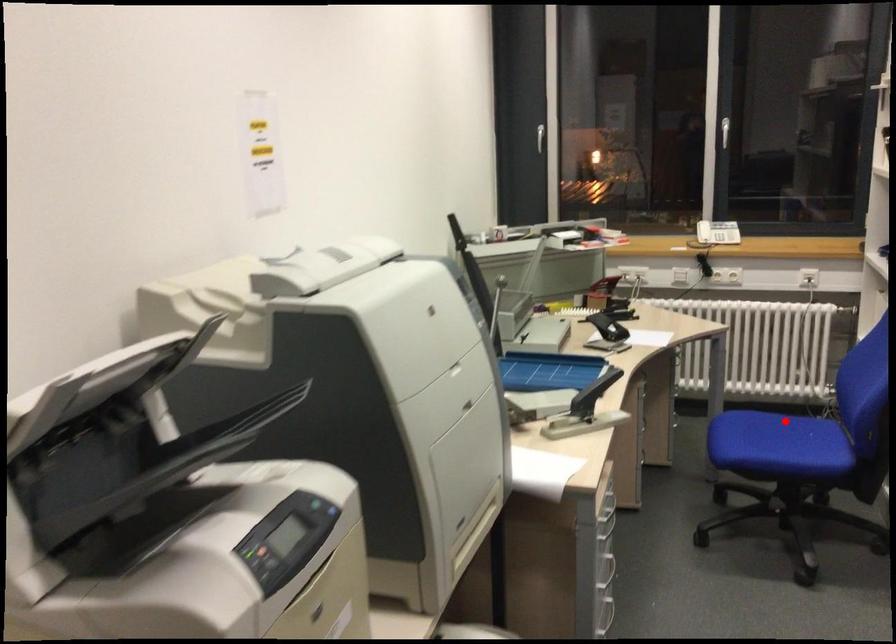
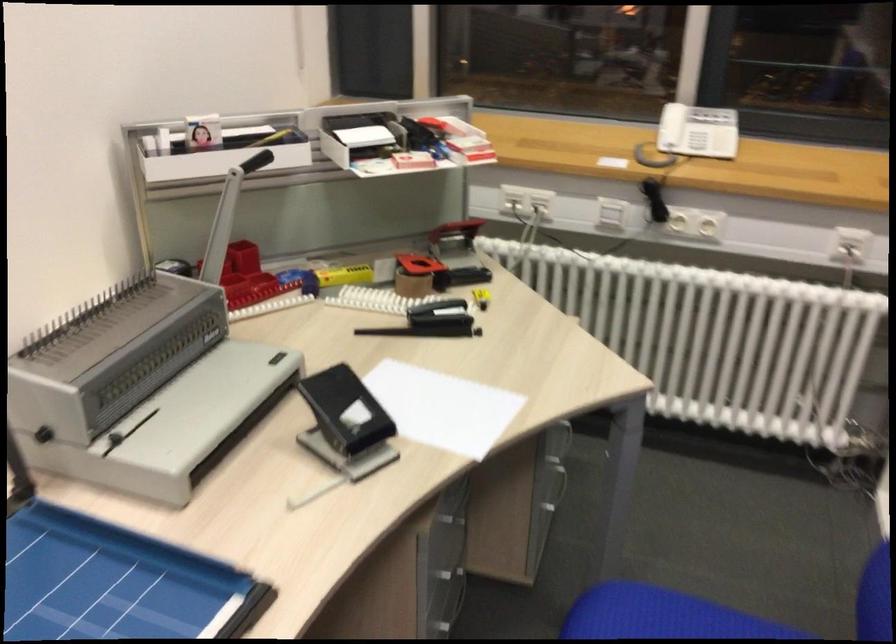
Question: A red point is marked in image1. In image2, is the corresponding 3D point closer to the camera or farther? Reply with the corresponding letter.

Choices:
 (A) The corresponding 3D point is closer.
 (B) The corresponding 3D point is farther.

Answer: (A)